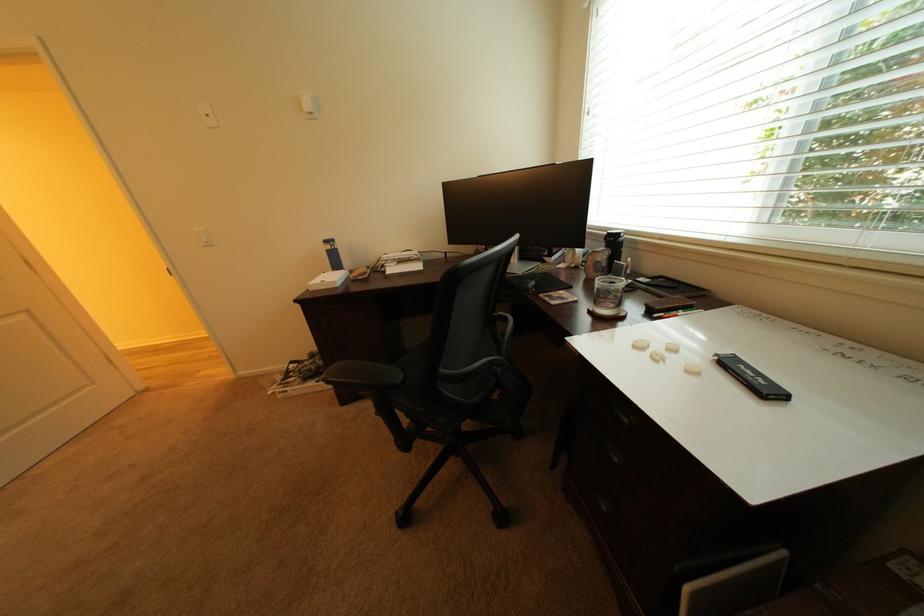
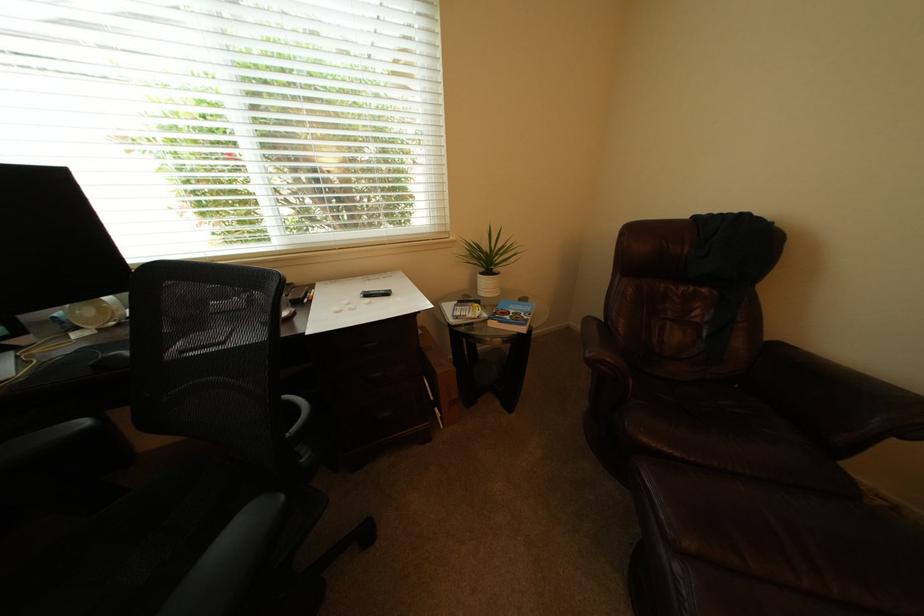
The first image is from the beginning of the video and the second image is from the end. How did the camera likely rotate when shooting the video?

The rotation direction of the camera is right-down.